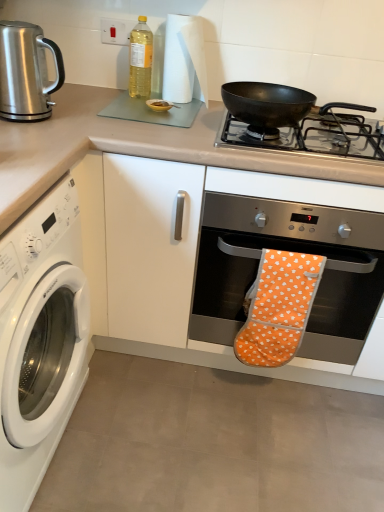
Question: Does white paper towel at upper center touch matte glass cutting board at upper center?

Choices:
 (A) yes
 (B) no

Answer: (B)

Question: Can matte glass cutting board at upper center be found inside white paper towel at upper center?

Choices:
 (A) yes
 (B) no

Answer: (B)

Question: Is white paper towel at upper center outside of matte glass cutting board at upper center?

Choices:
 (A) no
 (B) yes

Answer: (B)

Question: Is white paper towel at upper center smaller than matte glass cutting board at upper center?

Choices:
 (A) yes
 (B) no

Answer: (A)

Question: Is white paper towel at upper center positioned with its back to matte glass cutting board at upper center?

Choices:
 (A) no
 (B) yes

Answer: (A)

Question: Considering the relative sizes of white paper towel at upper center and matte glass cutting board at upper center in the image provided, is white paper towel at upper center bigger than matte glass cutting board at upper center?

Choices:
 (A) no
 (B) yes

Answer: (A)

Question: Is white paper towel at upper center next to black matte pan at upper right?

Choices:
 (A) no
 (B) yes

Answer: (A)

Question: From the image's perspective, is white paper towel at upper center located beneath black matte pan at upper right?

Choices:
 (A) no
 (B) yes

Answer: (A)

Question: Considering the relative sizes of white paper towel at upper center and black matte pan at upper right in the image provided, is white paper towel at upper center bigger than black matte pan at upper right?

Choices:
 (A) yes
 (B) no

Answer: (B)

Question: From the image's perspective, is white paper towel at upper center on top of black matte pan at upper right?

Choices:
 (A) yes
 (B) no

Answer: (A)

Question: Can you confirm if white paper towel at upper center is shorter than black matte pan at upper right?

Choices:
 (A) no
 (B) yes

Answer: (A)

Question: Can you confirm if white paper towel at upper center is thinner than black matte pan at upper right?

Choices:
 (A) no
 (B) yes

Answer: (B)

Question: Is orange fabric oven mitt at center beside white paper towel at upper center?

Choices:
 (A) no
 (B) yes

Answer: (A)